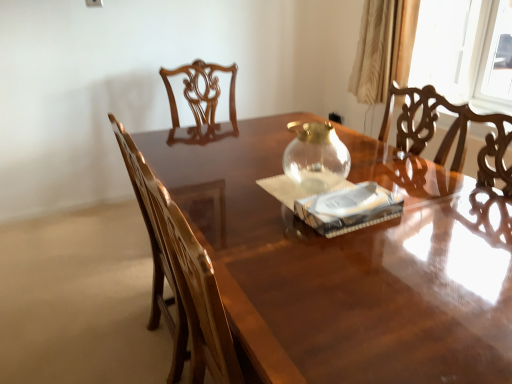
The image size is (512, 384). I want to click on vacant space underneath transparent glass teapot at center (from a real-world perspective), so click(x=313, y=173).